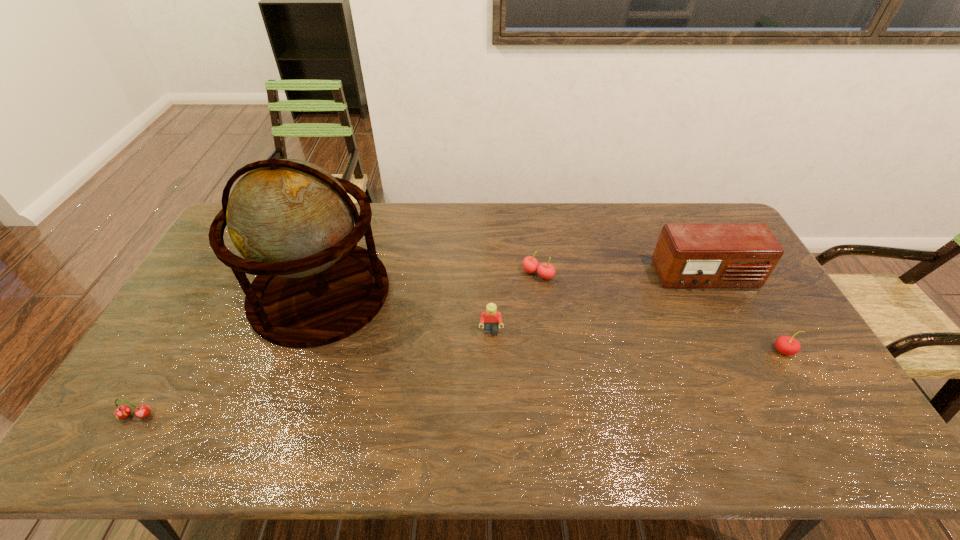
At what (x,y) coordinates should I click in order to perform the action: click on the tallest object. Please return your answer as a coordinate pair (x, y). The image size is (960, 540). Looking at the image, I should click on (293, 222).

The image size is (960, 540). Find the location of `the fifth object from right to left`. the fifth object from right to left is located at coordinates (293, 222).

Find the location of a particular element. radio receiver is located at coordinates tap(688, 255).

Identify the location of the third object from left to right. The image size is (960, 540). (491, 319).

At what (x,y) coordinates should I click in order to perform the action: click on the second nearest cherry. Please return your answer as a coordinate pair (x, y). This screenshot has height=540, width=960. Looking at the image, I should click on (786, 345).

The height and width of the screenshot is (540, 960). In order to click on the second cherry from left to right in this screenshot , I will do `click(530, 264)`.

Where is `the farthest cherry`? This screenshot has height=540, width=960. the farthest cherry is located at coordinates (530, 264).

Image resolution: width=960 pixels, height=540 pixels. What are the coordinates of `the nearest object` in the screenshot? It's located at (122, 411).

Locate an element on the screen. the shortest object is located at coordinates (122, 411).

Locate an element on the screen. free region located 0.300m on the front-facing side of the second object from left to right is located at coordinates (484, 293).